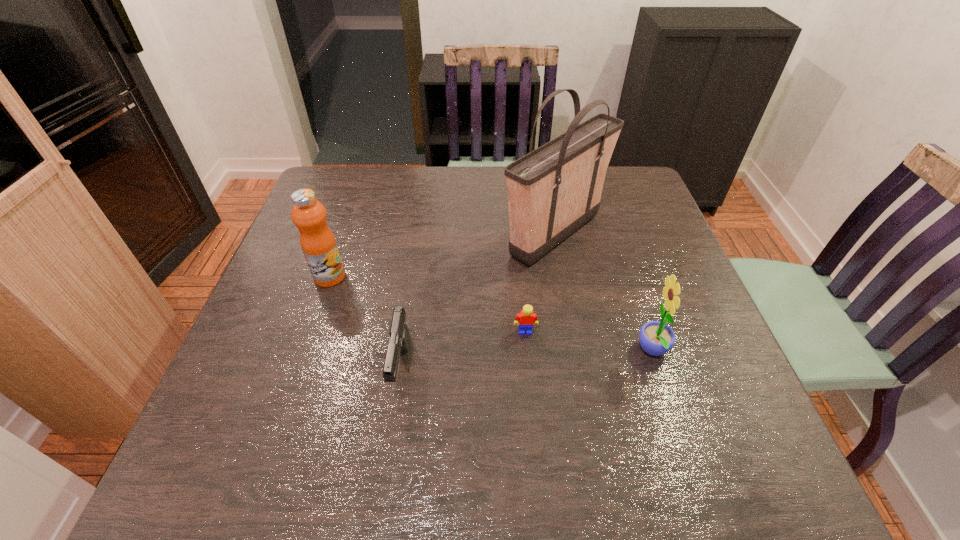
This screenshot has height=540, width=960. Find the location of `empty space that is in between the leftmost object and the third tallest object`. empty space that is in between the leftmost object and the third tallest object is located at coordinates (492, 314).

You are a GUI agent. You are given a task and a screenshot of the screen. Output one action in this format:
    pyautogui.click(x=<x>, y=<y>)
    Task: Click on the free area in between the shortest object and the fruit juice
    
    Given the screenshot: What is the action you would take?
    pyautogui.click(x=427, y=304)

At what (x,y) coordinates should I click in order to perform the action: click on empty space that is in between the sunflower and the tallest object. Please return your answer as a coordinate pair (x, y). This screenshot has width=960, height=540. Looking at the image, I should click on (604, 293).

Find the location of a particular element. This screenshot has width=960, height=540. object that stands as the second closest to the fruit juice is located at coordinates (555, 189).

Where is `object that is the nearest to the shortest object`? object that is the nearest to the shortest object is located at coordinates (555, 189).

Locate an element on the screen. The height and width of the screenshot is (540, 960). vacant space that satisfies the following two spatial constraints: 1. on the front-facing side of the third tallest object; 2. aim along the barrel of the pistol is located at coordinates (659, 369).

Where is `blank area in the image that satisfies the following two spatial constraints: 1. on the back side of the tallest object; 2. on the right side of the fruit juice`? blank area in the image that satisfies the following two spatial constraints: 1. on the back side of the tallest object; 2. on the right side of the fruit juice is located at coordinates (344, 235).

Where is `free space that satisfies the following two spatial constraints: 1. on the front-facing side of the third shortest object; 2. aim along the barrel of the fourth object from right to left`? The width and height of the screenshot is (960, 540). free space that satisfies the following two spatial constraints: 1. on the front-facing side of the third shortest object; 2. aim along the barrel of the fourth object from right to left is located at coordinates (659, 369).